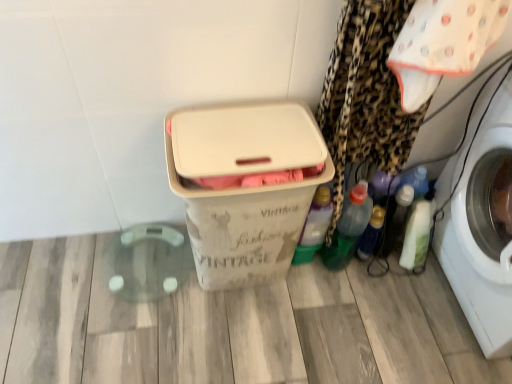
Question: Is white glossy bottle at lower right, marked as the fourth bottle in a left-to-right arrangement, next to beige plastic storage box at center?

Choices:
 (A) no
 (B) yes

Answer: (A)

Question: Is white glossy bottle at lower right, marked as the fourth bottle in a left-to-right arrangement, oriented towards beige plastic storage box at center?

Choices:
 (A) no
 (B) yes

Answer: (A)

Question: Is white glossy bottle at lower right, placed as the first bottle when sorted from right to left, further to the viewer compared to beige plastic storage box at center?

Choices:
 (A) no
 (B) yes

Answer: (B)

Question: Does white glossy bottle at lower right, marked as the fourth bottle in a left-to-right arrangement, have a lesser height compared to beige plastic storage box at center?

Choices:
 (A) yes
 (B) no

Answer: (A)

Question: From a real-world perspective, is white glossy bottle at lower right, marked as the fourth bottle in a left-to-right arrangement, positioned over beige plastic storage box at center based on gravity?

Choices:
 (A) no
 (B) yes

Answer: (A)

Question: From a real-world perspective, is white glossy bottle at lower right, placed as the first bottle when sorted from right to left, beneath beige plastic storage box at center?

Choices:
 (A) no
 (B) yes

Answer: (B)

Question: Can you confirm if green plastic bottle at lower right, marked as the second bottle in a left-to-right arrangement, is positioned to the right of translucent plastic bottle at lower right, the 3th bottle positioned from the left?

Choices:
 (A) no
 (B) yes

Answer: (A)

Question: Can you confirm if green plastic bottle at lower right, marked as the second bottle in a left-to-right arrangement, is smaller than translucent plastic bottle at lower right, the second bottle in the right-to-left sequence?

Choices:
 (A) yes
 (B) no

Answer: (B)

Question: From the image's perspective, would you say green plastic bottle at lower right, the 3th bottle viewed from the right, is positioned over translucent plastic bottle at lower right, the second bottle in the right-to-left sequence?

Choices:
 (A) yes
 (B) no

Answer: (A)

Question: Is green plastic bottle at lower right, marked as the second bottle in a left-to-right arrangement, behind translucent plastic bottle at lower right, the 3th bottle positioned from the left?

Choices:
 (A) no
 (B) yes

Answer: (A)

Question: Is green plastic bottle at lower right, the 3th bottle viewed from the right, shorter than translucent plastic bottle at lower right, the 3th bottle positioned from the left?

Choices:
 (A) no
 (B) yes

Answer: (A)

Question: Does green plastic bottle at lower right, marked as the second bottle in a left-to-right arrangement, have a lesser width compared to translucent plastic bottle at lower right, the 3th bottle positioned from the left?

Choices:
 (A) yes
 (B) no

Answer: (B)

Question: Is translucent plastic bottle at lower right, the second bottle in the right-to-left sequence, taller than white cotton cloth at upper right?

Choices:
 (A) no
 (B) yes

Answer: (A)